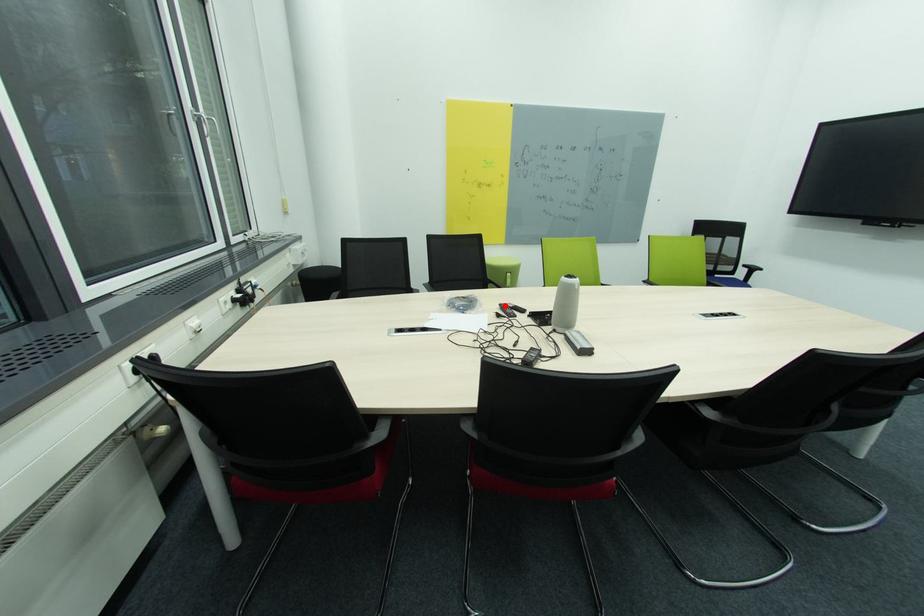
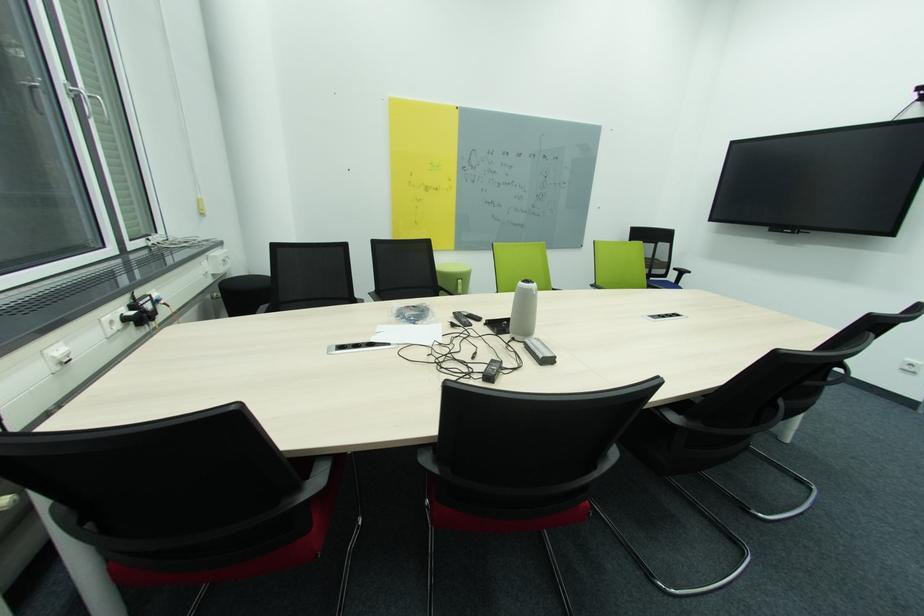
Where in the second image is the point corresponding to the highlighted location from the first image?

(458, 314)